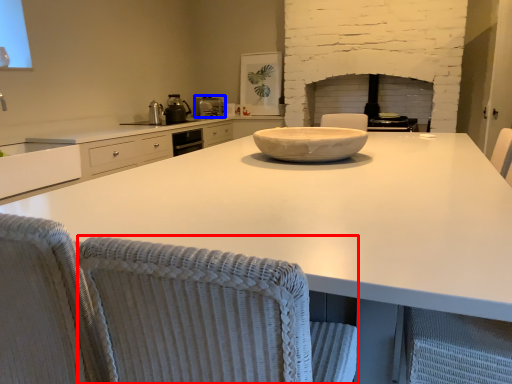
Question: Which object is closer to the camera taking this photo, swivel chair (highlighted by a red box) or kitchen appliance (highlighted by a blue box)?

Choices:
 (A) swivel chair
 (B) kitchen appliance

Answer: (A)